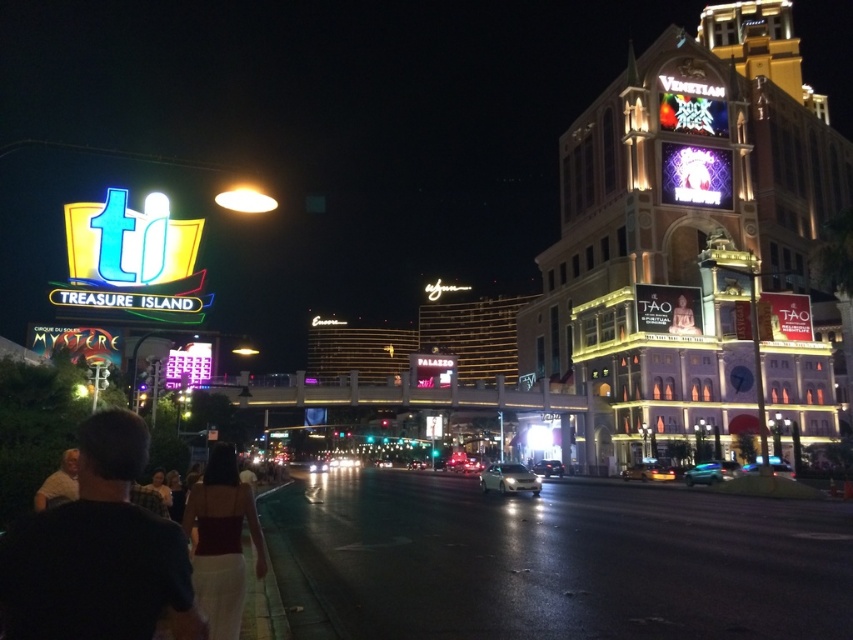
Which of these two, dark brown shirt at lower left or yellow metallic car at center, stands shorter?

yellow metallic car at center is shorter.

Measure the distance from dark brown shirt at lower left to yellow metallic car at center.

The distance of dark brown shirt at lower left from yellow metallic car at center is 59.87 meters.

What do you see at coordinates (97, 552) in the screenshot? This screenshot has width=853, height=640. I see `dark brown shirt at lower left` at bounding box center [97, 552].

The width and height of the screenshot is (853, 640). Identify the location of dark brown shirt at lower left. (97, 552).

Which is below, yellow metallic car at center or shiny silver car at center?

shiny silver car at center

What do you see at coordinates (648, 472) in the screenshot?
I see `yellow metallic car at center` at bounding box center [648, 472].

Find the location of a particular element. The height and width of the screenshot is (640, 853). yellow metallic car at center is located at coordinates (648, 472).

Identify the location of yellow metallic car at center. (648, 472).

Can you confirm if shiny silver car at center is positioned to the right of shiny silver sedan at center?

Incorrect, shiny silver car at center is not on the right side of shiny silver sedan at center.

Is shiny silver car at center below shiny silver sedan at center?

Yes.

Does point (474, 465) come farther from viewer compared to point (550, 476)?

Yes, it is.

Where is `shiny silver car at center`? shiny silver car at center is located at coordinates (463, 464).